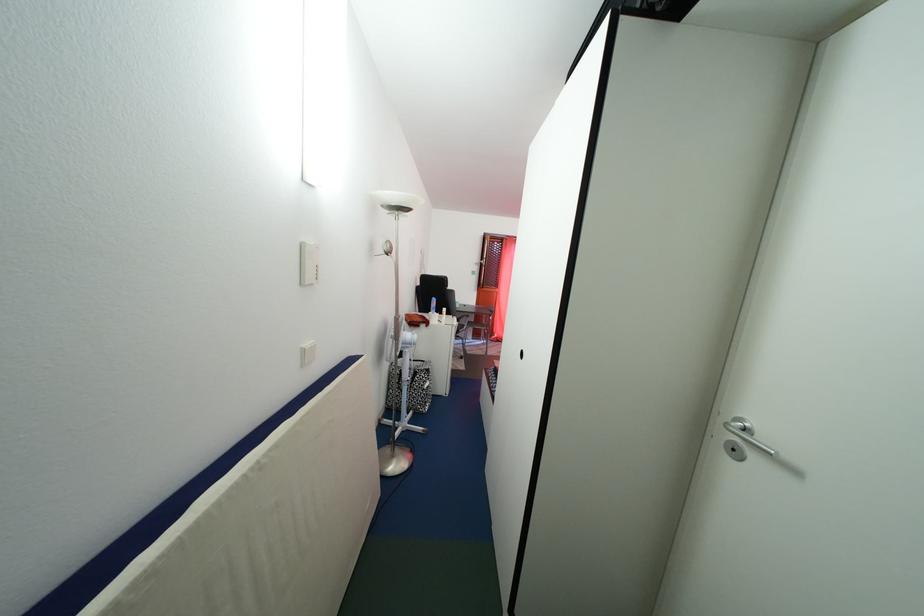
Locate an element on the screen. Image resolution: width=924 pixels, height=616 pixels. silver door handle is located at coordinates (746, 436).